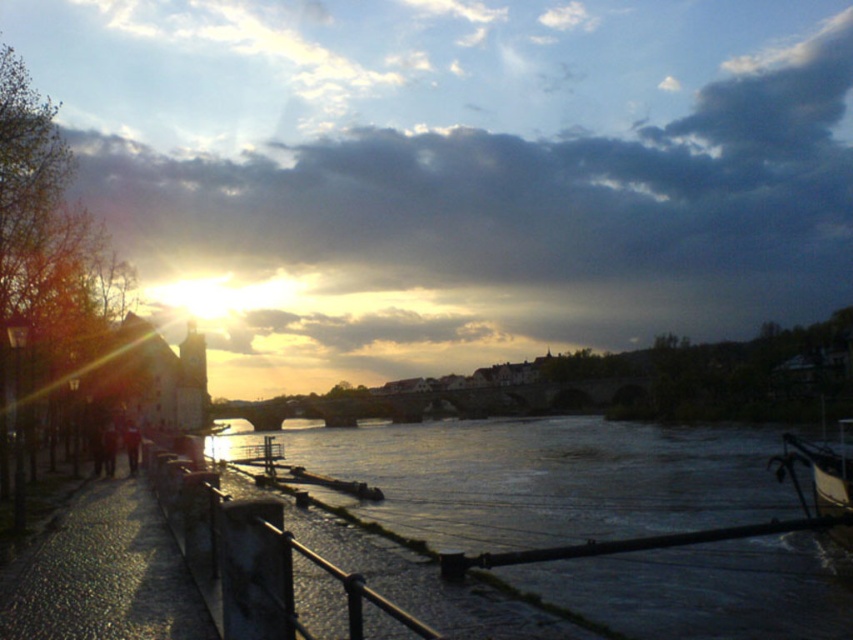
Question: Where is silvery reflective water at center located in relation to smooth concrete railing at lower left in the image?

Choices:
 (A) above
 (B) below

Answer: (B)

Question: Can you confirm if silvery reflective water at center is wider than metallic polished boat at lower right?

Choices:
 (A) yes
 (B) no

Answer: (A)

Question: From the image, what is the correct spatial relationship of silvery reflective water at center in relation to smooth concrete railing at lower left?

Choices:
 (A) left
 (B) right

Answer: (B)

Question: Estimate the real-world distances between objects in this image. Which object is closer to the smooth concrete railing at lower left?

Choices:
 (A) metallic polished boat at lower right
 (B) silvery reflective water at center

Answer: (A)

Question: Among these points, which one is nearest to the camera?

Choices:
 (A) (230, 580)
 (B) (635, 497)
 (C) (822, 497)

Answer: (A)

Question: Among these objects, which one is farthest from the camera?

Choices:
 (A) silvery reflective water at center
 (B) smooth concrete railing at lower left

Answer: (A)